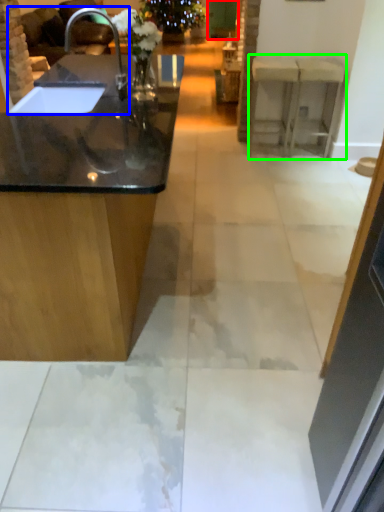
Question: Estimate the real-world distances between objects in this image. Which object is farther from glass door (highlighted by a red box), sink (highlighted by a blue box) or counter (highlighted by a green box)?

Choices:
 (A) sink
 (B) counter

Answer: (B)